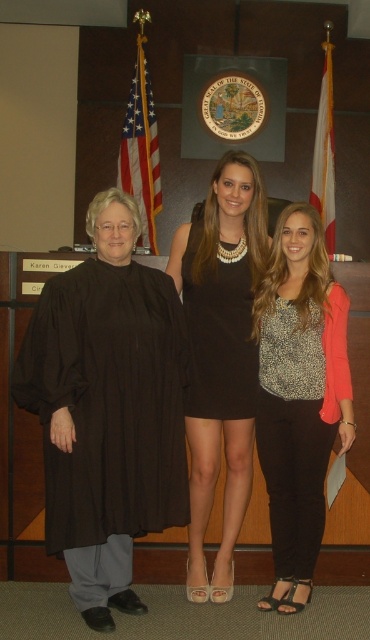
You are a photographer who needs to capture a closeup shot of both the leopard print blouse at center and the black satin dress at center. The camera you are using has a minimum focusing distance of 20 centimeters. Can you take the photo without moving either of the subjects?

The leopard print blouse at center is 23.62 centimeters from the black satin dress at center. Since the minimum focusing distance is 20 centimeters, the photographer can take the photo without moving either subject as the distance between them is sufficient.